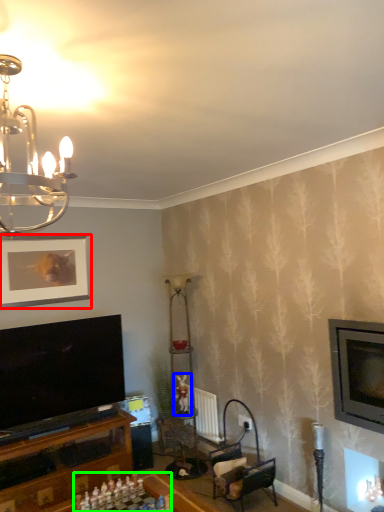
Question: Estimate the real-world distances between objects in this image. Which object is farther from picture frame (highlighted by a red box), toy (highlighted by a blue box) or board game (highlighted by a green box)?

Choices:
 (A) toy
 (B) board game

Answer: (B)